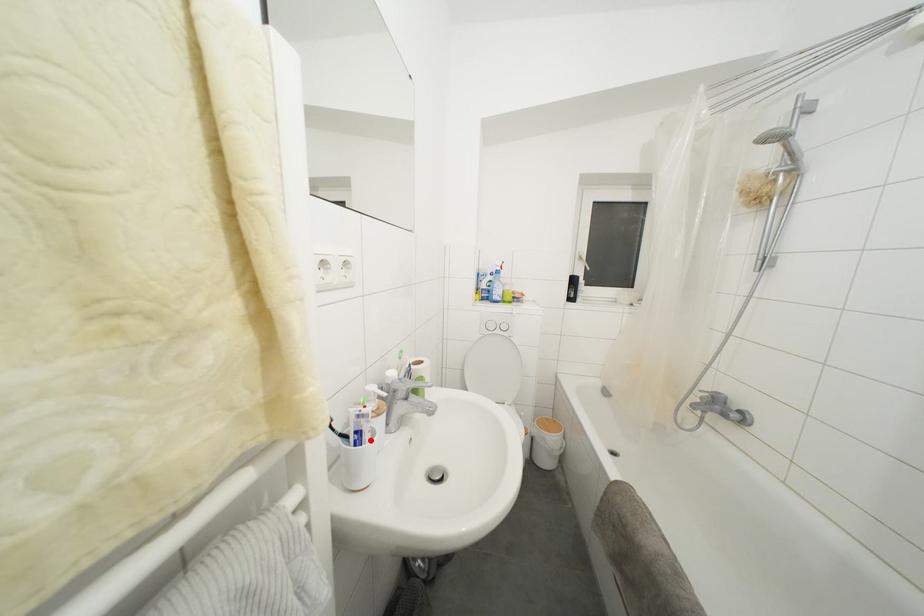
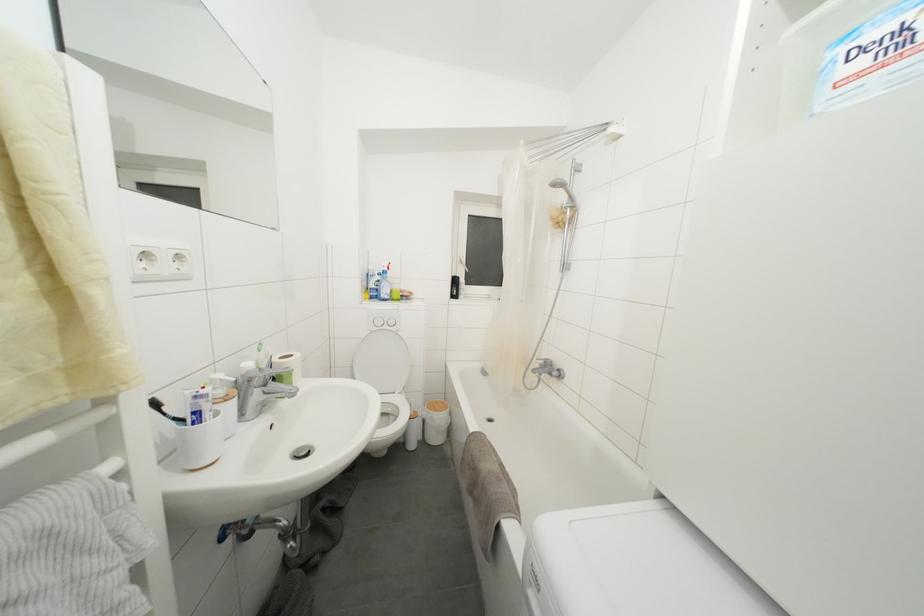
Locate, in the second image, the point that corresponds to the highlighted location in the first image.

(211, 419)